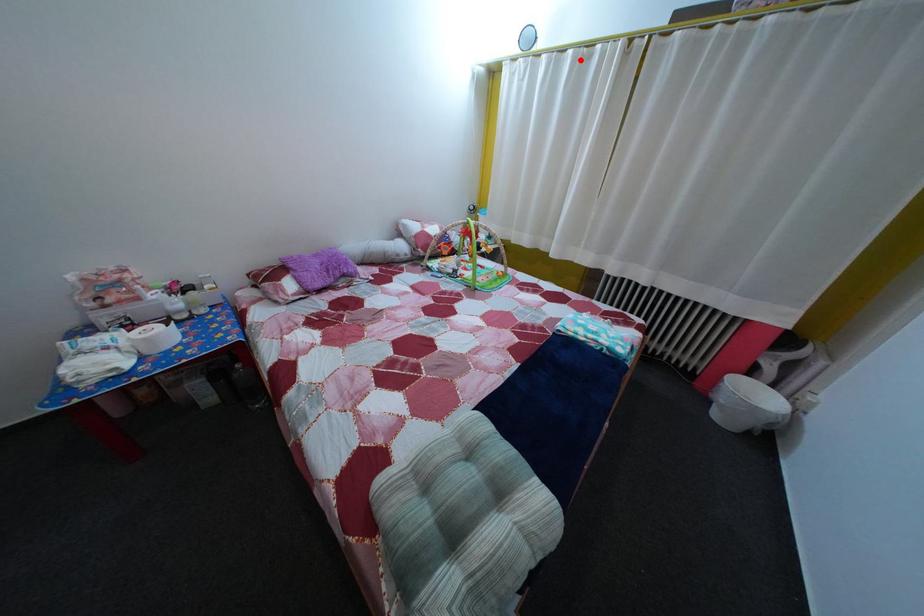
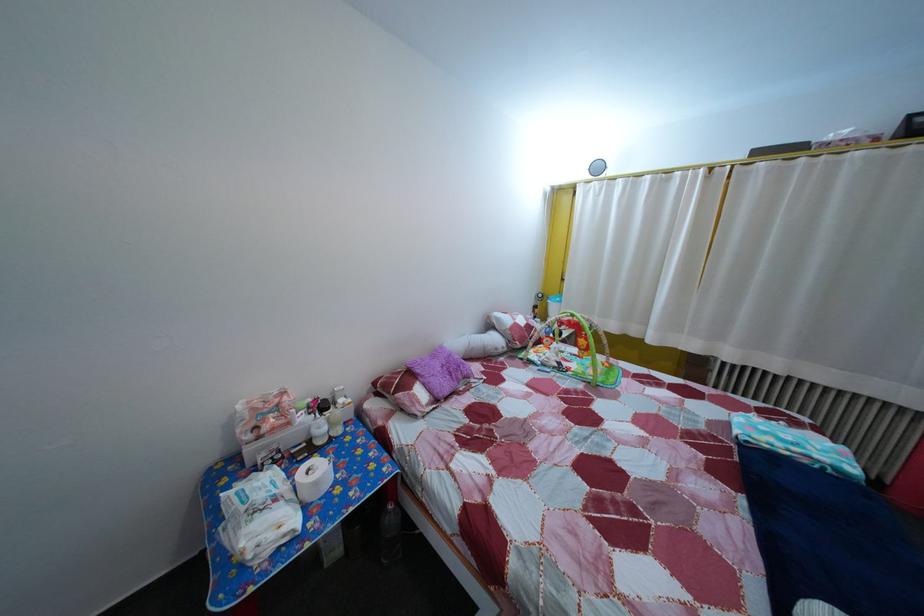
Locate, in the second image, the point that corresponds to the highlighted location in the first image.

(659, 185)